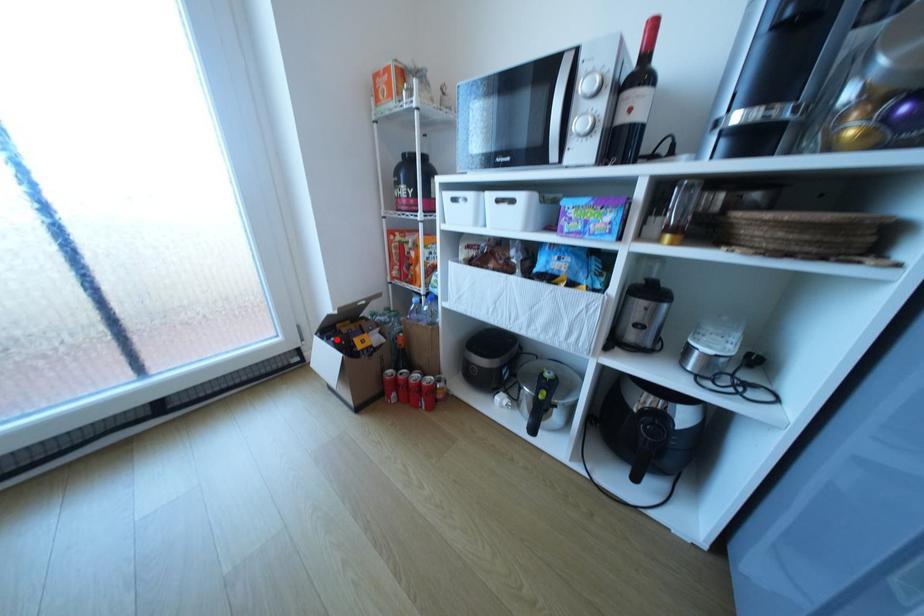
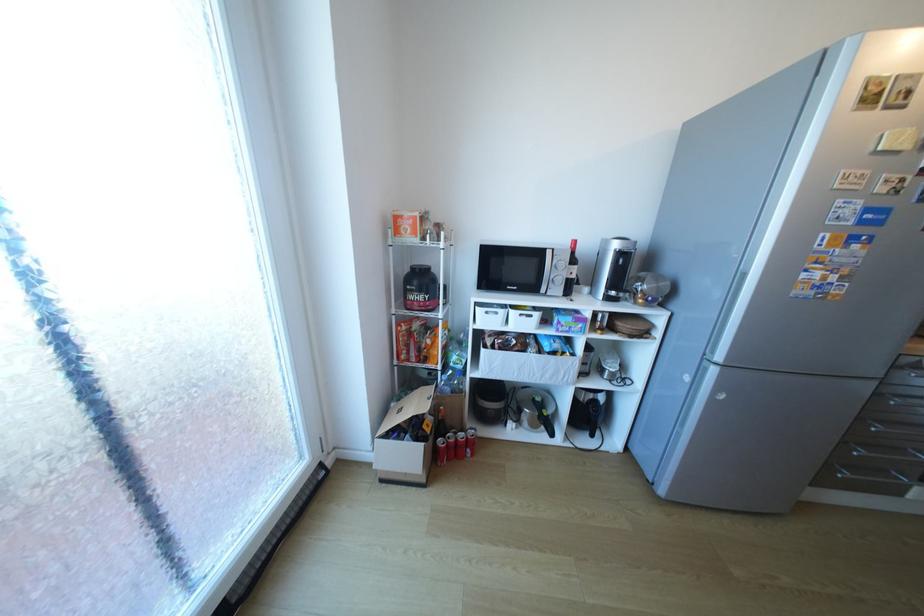
Question: I am providing you with two images of the same scene from different viewpoints. Given a red point in image1, look at the same physical point in image2. Is it:

Choices:
 (A) Closer to the viewpoint
 (B) Farther from the viewpoint

Answer: (B)